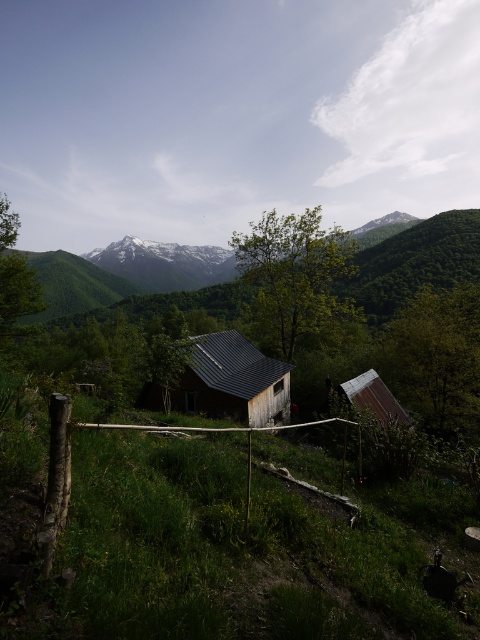
Is dark gray shingles at center positioned behind rusty metal hut at lower right?

Yes, dark gray shingles at center is behind rusty metal hut at lower right.

Does dark gray shingles at center have a larger size compared to rusty metal hut at lower right?

Correct, dark gray shingles at center is larger in size than rusty metal hut at lower right.

Is point (256, 396) positioned before point (386, 401)?

Yes, it is in front of point (386, 401).

Find the location of a particular element. Image resolution: width=480 pixels, height=640 pixels. dark gray shingles at center is located at coordinates (233, 380).